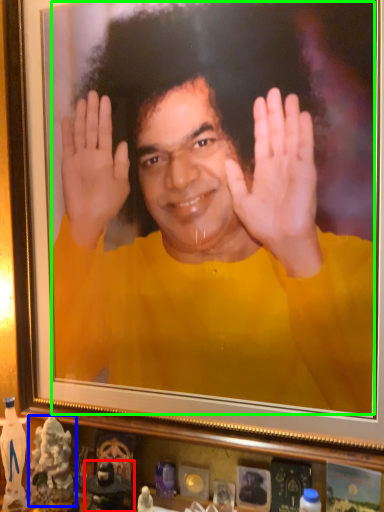
Question: Considering the real-world distances, which object is closest to toy (highlighted by a red box)? toy (highlighted by a blue box) or man (highlighted by a green box).

Choices:
 (A) toy
 (B) man

Answer: (A)